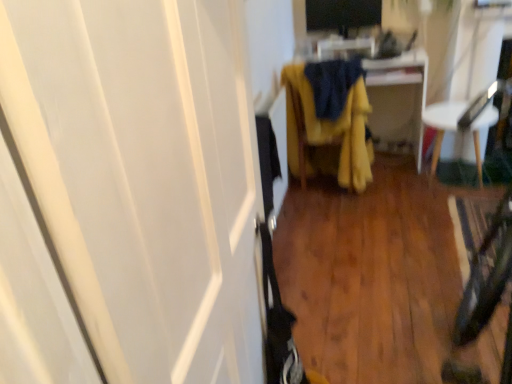
Question: From a real-world perspective, does black glossy monitor at upper center stand above white glossy screen door at left?

Choices:
 (A) yes
 (B) no

Answer: (A)

Question: Does black glossy monitor at upper center have a larger size compared to white glossy screen door at left?

Choices:
 (A) yes
 (B) no

Answer: (B)

Question: Is black glossy monitor at upper center to the right of white glossy screen door at left from the viewer's perspective?

Choices:
 (A) yes
 (B) no

Answer: (A)

Question: Considering the relative sizes of black glossy monitor at upper center and white glossy screen door at left in the image provided, is black glossy monitor at upper center shorter than white glossy screen door at left?

Choices:
 (A) yes
 (B) no

Answer: (A)

Question: From a real-world perspective, is black glossy monitor at upper center located beneath white glossy screen door at left?

Choices:
 (A) no
 (B) yes

Answer: (A)

Question: Which is correct: yellow fabric chair at center, which appears as the first furniture when viewed from the left, is inside black glossy monitor at upper center, or outside of it?

Choices:
 (A) inside
 (B) outside

Answer: (B)

Question: Is yellow fabric chair at center, which is the second furniture in right-to-left order, taller or shorter than black glossy monitor at upper center?

Choices:
 (A) short
 (B) tall

Answer: (B)

Question: Considering the positions of yellow fabric chair at center, which appears as the first furniture when viewed from the left, and black glossy monitor at upper center in the image, is yellow fabric chair at center, which appears as the first furniture when viewed from the left, bigger or smaller than black glossy monitor at upper center?

Choices:
 (A) big
 (B) small

Answer: (A)

Question: From the image's perspective, relative to black glossy monitor at upper center, is yellow fabric chair at center, which is the second furniture in right-to-left order, above or below?

Choices:
 (A) below
 (B) above

Answer: (A)

Question: Based on their positions, is black glossy monitor at upper center located to the left or right of white glossy screen door at left?

Choices:
 (A) right
 (B) left

Answer: (A)

Question: Is point (373, 19) positioned closer to the camera than point (89, 82)?

Choices:
 (A) farther
 (B) closer

Answer: (A)

Question: From the image's perspective, is black glossy monitor at upper center above or below white glossy screen door at left?

Choices:
 (A) below
 (B) above

Answer: (B)

Question: Is black glossy monitor at upper center wider or thinner than white glossy screen door at left?

Choices:
 (A) thin
 (B) wide

Answer: (A)

Question: Visually, is white glossy screen door at left positioned to the left or to the right of yellow fabric chair at center, which is the second furniture in right-to-left order?

Choices:
 (A) left
 (B) right

Answer: (A)

Question: Choose the correct answer: Is white glossy screen door at left inside yellow fabric chair at center, which appears as the first furniture when viewed from the left, or outside it?

Choices:
 (A) outside
 (B) inside

Answer: (A)